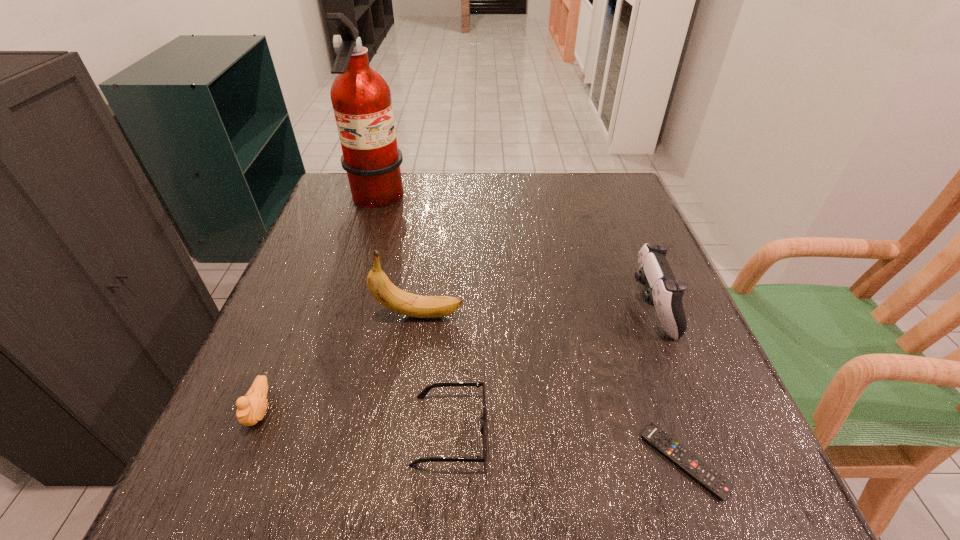
Identify the location of the tallest object. This screenshot has height=540, width=960. (361, 99).

Where is `fire extinguisher`? The height and width of the screenshot is (540, 960). fire extinguisher is located at coordinates click(x=361, y=99).

The width and height of the screenshot is (960, 540). I want to click on banana, so click(x=383, y=290).

Where is `the third tallest object`? The width and height of the screenshot is (960, 540). the third tallest object is located at coordinates (664, 292).

Image resolution: width=960 pixels, height=540 pixels. What are the coordinates of `the third shortest object` in the screenshot? It's located at (250, 409).

Locate an element on the screen. This screenshot has height=540, width=960. the second shortest object is located at coordinates (422, 395).

Where is `the shortest object`? the shortest object is located at coordinates (713, 481).

The height and width of the screenshot is (540, 960). What are the coordinates of `vacant region located 0.370m on the nozzle and handle of the farthest object` in the screenshot? It's located at (540, 200).

The width and height of the screenshot is (960, 540). Identify the location of free space located 0.260m at the start of the peel on the fifth shortest object. (592, 315).

Identify the location of vacant space located on the front-facing side of the control. tap(492, 308).